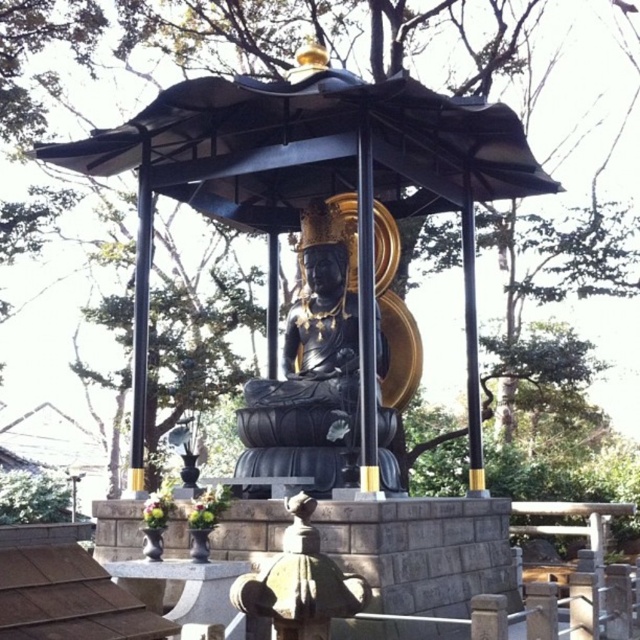
Question: Can you confirm if metallic gold pole at center is positioned to the right of black polished pole at left?

Choices:
 (A) yes
 (B) no

Answer: (A)

Question: Is metallic gold pole at center closer to the viewer compared to black polished pole at left?

Choices:
 (A) yes
 (B) no

Answer: (A)

Question: Which point is closer to the camera taking this photo?

Choices:
 (A) (392, 365)
 (B) (371, 397)

Answer: (B)

Question: Which point is closer to the camera taking this photo?

Choices:
 (A) (134, 387)
 (B) (371, 163)
 (C) (481, 148)

Answer: (B)

Question: Among these objects, which one is farthest from the camera?

Choices:
 (A) black polished statue at center
 (B) black polished stone gazebo at center
 (C) black polished pole at left
 (D) metallic gold pole at center

Answer: (C)

Question: Can you confirm if black polished statue at center is positioned to the left of black polished pole at left?

Choices:
 (A) no
 (B) yes

Answer: (A)